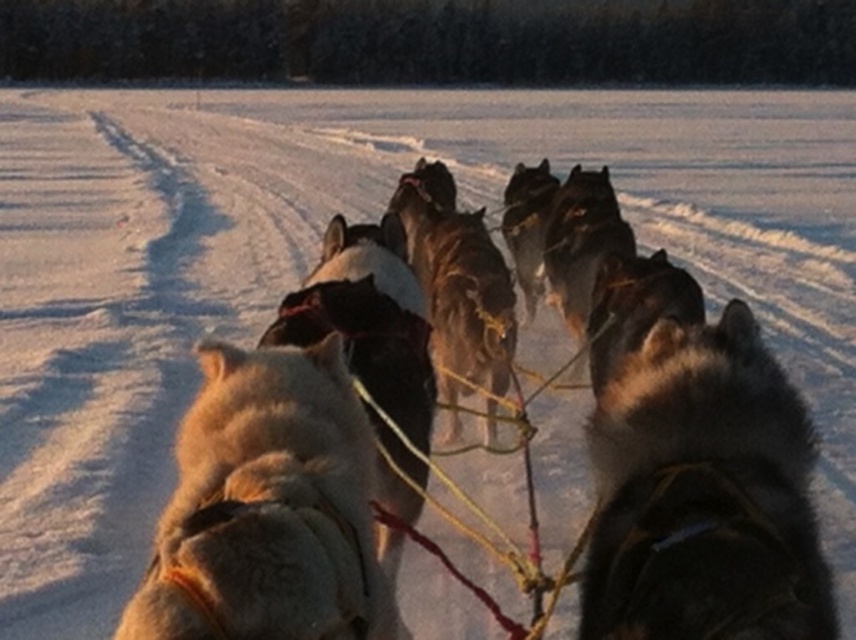
Question: Which of the following is the farthest from the observer?

Choices:
 (A) black fur dog at center
 (B) fuzzy white dog at center

Answer: (A)

Question: Does black fur dog at center have a larger size compared to fuzzy white dog at center?

Choices:
 (A) no
 (B) yes

Answer: (A)

Question: Can you confirm if black fur dog at center is smaller than fuzzy white dog at center?

Choices:
 (A) no
 (B) yes

Answer: (B)

Question: Which of the following is the closest to the observer?

Choices:
 (A) (693, 461)
 (B) (152, 582)

Answer: (B)

Question: From the image, what is the correct spatial relationship of black fur dog at center in relation to fuzzy white dog at center?

Choices:
 (A) left
 (B) right

Answer: (B)